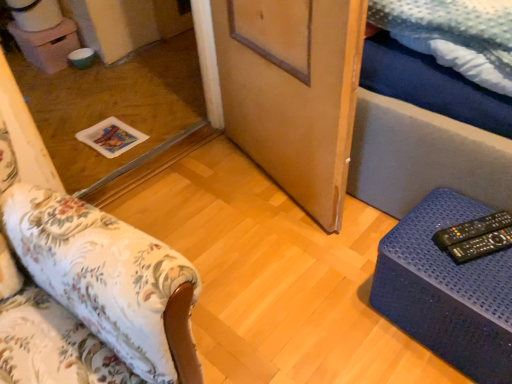
Question: In terms of width, does transparent glass door at center look wider or thinner when compared to blue textured ottoman at lower right, the first furniture in the right-to-left sequence?

Choices:
 (A) wide
 (B) thin

Answer: (A)

Question: Considering their positions, is transparent glass door at center located in front of or behind blue textured ottoman at lower right, which is counted as the second furniture, starting from the left?

Choices:
 (A) behind
 (B) front

Answer: (A)

Question: Which object is the farthest from the transparent glass door at center?

Choices:
 (A) floral fabric ottoman at lower left, which is counted as the first furniture, starting from the left
 (B) black plastic remote at lower right, the second remote in the front-to-back sequence
 (C) black plastic remote at lower right, the 2th remote viewed from the back
 (D) blue textured ottoman at lower right, which is counted as the second furniture, starting from the left
 (E) wooden door at center

Answer: (C)

Question: Considering the real-world distances, which object is closest to the black plastic remote at lower right, the 2th remote viewed from the back?

Choices:
 (A) floral fabric ottoman at lower left, the 2th furniture in the right-to-left sequence
 (B) blue textured ottoman at lower right, the first furniture in the right-to-left sequence
 (C) wooden door at center
 (D) black plastic remote at lower right, the second remote in the front-to-back sequence
 (E) transparent glass door at center

Answer: (D)